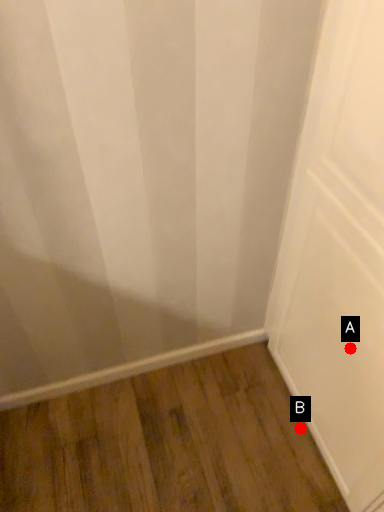
Question: Two points are circled on the image, labeled by A and B beside each circle. Which point is farther from the camera taking this photo?

Choices:
 (A) A is further
 (B) B is further

Answer: (B)